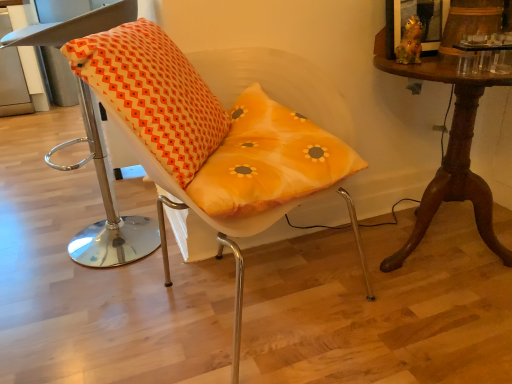
What is the approximate width of orange fabric cushion at left, which is the first chair from left to right?

orange fabric cushion at left, which is the first chair from left to right, is 16.74 inches wide.

At what (x,y) coordinates should I click in order to perform the action: click on orange fabric cushion at left, the second chair viewed from the right. Please return your answer as a coordinate pair (x, y). Image resolution: width=512 pixels, height=384 pixels. Looking at the image, I should click on (106, 208).

What do you see at coordinates (208, 139) in the screenshot?
I see `translucent orange cushion at center, the first chair in the right-to-left sequence` at bounding box center [208, 139].

Locate an element on the screen. The height and width of the screenshot is (384, 512). orange printed cushion at left is located at coordinates (153, 93).

The width and height of the screenshot is (512, 384). Identify the location of orange fabric cushion at left, which is the first chair from left to right. (106, 208).

The height and width of the screenshot is (384, 512). I want to click on chair beneath the orange fabric cushion at left, the second chair viewed from the right (from a real-world perspective), so click(x=208, y=139).

Is orange fabric cushion at left, the second chair viewed from the right, at the right side of translucent orange cushion at center, the second chair when ordered from left to right?

In fact, orange fabric cushion at left, the second chair viewed from the right, is to the left of translucent orange cushion at center, the second chair when ordered from left to right.

Which of these two, orange fabric cushion at left, the second chair viewed from the right, or translucent orange cushion at center, the second chair when ordered from left to right, is wider?

translucent orange cushion at center, the second chair when ordered from left to right, is wider.

Between translucent orange cushion at center, the second chair when ordered from left to right, and mahogany wood table at right, which one has smaller width?

mahogany wood table at right is thinner.

Locate an element on the screen. chair in front of the mahogany wood table at right is located at coordinates (208, 139).

Choose the correct answer: Is translucent orange cushion at center, the second chair when ordered from left to right, inside mahogany wood table at right or outside it?

translucent orange cushion at center, the second chair when ordered from left to right, cannot be found inside mahogany wood table at right.

From the picture: From the image's perspective, between translucent orange cushion at center, the first chair in the right-to-left sequence, and orange printed cushion at left, which one is located above?

orange printed cushion at left appears higher in the image.

Does translucent orange cushion at center, the second chair when ordered from left to right, come behind orange printed cushion at left?

No.

In order to click on throw pillow behind the translucent orange cushion at center, the second chair when ordered from left to right in this screenshot , I will do `click(153, 93)`.

Does mahogany wood table at right turn towards orange fabric cushion at left, the second chair viewed from the right?

No, mahogany wood table at right is not aimed at orange fabric cushion at left, the second chair viewed from the right.

What's the angular difference between mahogany wood table at right and orange fabric cushion at left, the second chair viewed from the right,'s facing directions?

They differ by 104 degrees in their facing directions.

Is mahogany wood table at right shorter than orange fabric cushion at left, which is the first chair from left to right?

Indeed, mahogany wood table at right has a lesser height compared to orange fabric cushion at left, which is the first chair from left to right.

From a real-world perspective, does mahogany wood table at right stand above orange fabric cushion at left, which is the first chair from left to right?

Actually, mahogany wood table at right is physically below orange fabric cushion at left, which is the first chair from left to right, in the real world.

How many degrees apart are the facing directions of orange printed cushion at left and orange fabric cushion at left, the second chair viewed from the right?

The facing directions of orange printed cushion at left and orange fabric cushion at left, the second chair viewed from the right, are 83.7 degrees apart.

Considering the points (154, 101) and (86, 116), which point is in front, point (154, 101) or point (86, 116)?

The point (154, 101) is more forward.

Is orange printed cushion at left shorter than orange fabric cushion at left, which is the first chair from left to right?

Indeed, orange printed cushion at left has a lesser height compared to orange fabric cushion at left, which is the first chair from left to right.

Is orange printed cushion at left far away from orange fabric cushion at left, the second chair viewed from the right?

orange printed cushion at left is near orange fabric cushion at left, the second chair viewed from the right, not far away.

Who is shorter, orange printed cushion at left or mahogany wood table at right?

orange printed cushion at left is shorter.

From a real-world perspective, is orange printed cushion at left on mahogany wood table at right?

Yes, from a real-world perspective, orange printed cushion at left is over mahogany wood table at right

Is orange printed cushion at left closer to camera compared to mahogany wood table at right?

Yes.

Between orange printed cushion at left and mahogany wood table at right, which one has larger size?

Bigger between the two is mahogany wood table at right.

From the image's perspective, between orange printed cushion at left and translucent orange cushion at center, the first chair in the right-to-left sequence, which one is located above?

orange printed cushion at left is shown above in the image.

Is orange printed cushion at left in front of or behind translucent orange cushion at center, the first chair in the right-to-left sequence, in the image?

Clearly, orange printed cushion at left is behind translucent orange cushion at center, the first chair in the right-to-left sequence.

From a real-world perspective, which object stands above the other?

orange printed cushion at left, from a real-world perspective.

In order to click on chair in front of the orange fabric cushion at left, which is the first chair from left to right in this screenshot , I will do `click(208, 139)`.

The height and width of the screenshot is (384, 512). I want to click on table to the right of translucent orange cushion at center, the second chair when ordered from left to right, so click(x=449, y=151).

Consider the image. Estimate the real-world distances between objects in this image. Which object is further from orange fabric cushion at left, which is the first chair from left to right, orange printed cushion at left or mahogany wood table at right?

Among the two, mahogany wood table at right is located further to orange fabric cushion at left, which is the first chair from left to right.

Which object lies further to the anchor point orange fabric cushion at left, the second chair viewed from the right, mahogany wood table at right or orange printed cushion at left?

mahogany wood table at right is further to orange fabric cushion at left, the second chair viewed from the right.

From the image, which object appears to be nearer to translucent orange cushion at center, the first chair in the right-to-left sequence, mahogany wood table at right or orange fabric cushion at left, the second chair viewed from the right?

Based on the image, mahogany wood table at right appears to be nearer to translucent orange cushion at center, the first chair in the right-to-left sequence.

Looking at this image, looking at the image, which one is located further to translucent orange cushion at center, the first chair in the right-to-left sequence, orange fabric cushion at left, which is the first chair from left to right, or orange printed cushion at left?

orange fabric cushion at left, which is the first chair from left to right, is positioned further to the anchor translucent orange cushion at center, the first chair in the right-to-left sequence.

When comparing their distances from translucent orange cushion at center, the first chair in the right-to-left sequence, does orange printed cushion at left or orange fabric cushion at left, which is the first chair from left to right, seem closer?

Based on the image, orange printed cushion at left appears to be nearer to translucent orange cushion at center, the first chair in the right-to-left sequence.

When comparing their distances from mahogany wood table at right, does translucent orange cushion at center, the first chair in the right-to-left sequence, or orange fabric cushion at left, which is the first chair from left to right, seem further?

Among the two, orange fabric cushion at left, which is the first chair from left to right, is located further to mahogany wood table at right.

Which object lies further to the anchor point mahogany wood table at right, orange printed cushion at left or translucent orange cushion at center, the second chair when ordered from left to right?

orange printed cushion at left.

Based on their spatial positions, is orange fabric cushion at left, which is the first chair from left to right, or translucent orange cushion at center, the first chair in the right-to-left sequence, closer to mahogany wood table at right?

translucent orange cushion at center, the first chair in the right-to-left sequence, is positioned closer to the anchor mahogany wood table at right.

Where is `throw pillow between translucent orange cushion at center, the first chair in the right-to-left sequence, and orange fabric cushion at left, which is the first chair from left to right, from front to back`? Image resolution: width=512 pixels, height=384 pixels. throw pillow between translucent orange cushion at center, the first chair in the right-to-left sequence, and orange fabric cushion at left, which is the first chair from left to right, from front to back is located at coordinates (153, 93).

I want to click on chair located between orange fabric cushion at left, which is the first chair from left to right, and mahogany wood table at right in the left-right direction, so click(x=208, y=139).

The image size is (512, 384). In order to click on chair between orange printed cushion at left and mahogany wood table at right in the horizontal direction in this screenshot , I will do `click(208, 139)`.

I want to click on throw pillow between orange fabric cushion at left, which is the first chair from left to right, and mahogany wood table at right, so click(153, 93).